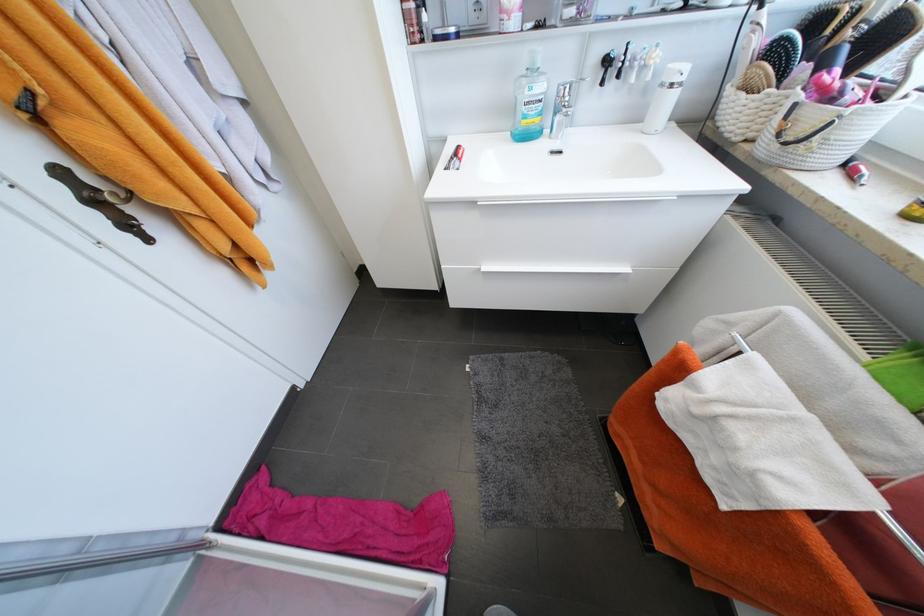
Where is `white dispenser pump`? white dispenser pump is located at coordinates (674, 79).